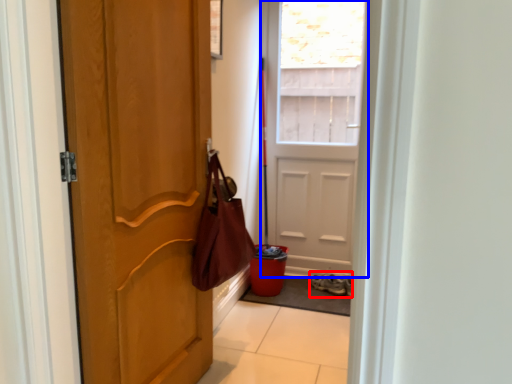
Question: Among these objects, which one is nearest to the camera, footwear (highlighted by a red box) or door (highlighted by a blue box)?

Choices:
 (A) footwear
 (B) door

Answer: (B)